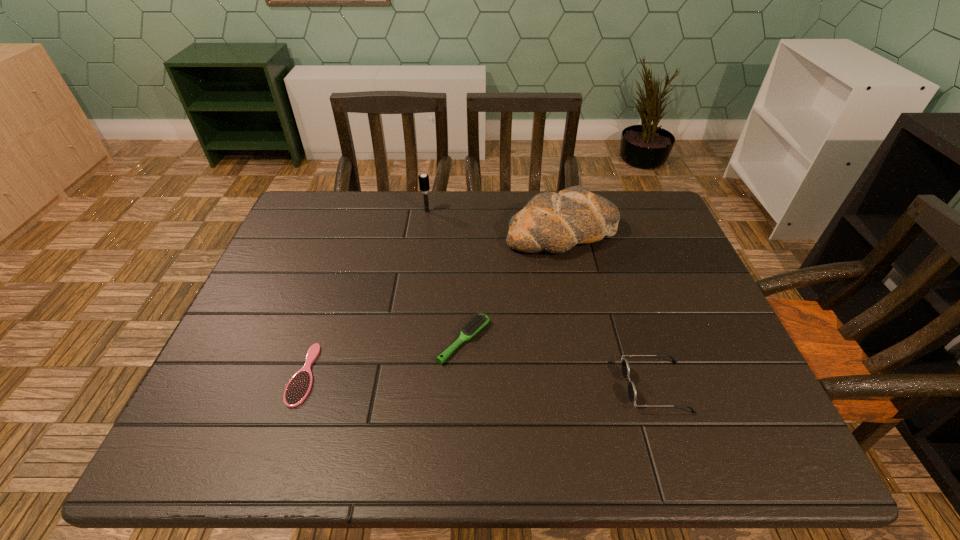
Where is `the second object from left to right`? the second object from left to right is located at coordinates (424, 183).

Identify the location of the second hairbrush from right to left. The image size is (960, 540). coord(424,183).

The height and width of the screenshot is (540, 960). In order to click on bread in this screenshot , I will do `click(555, 222)`.

Identify the location of the third shortest object. This screenshot has height=540, width=960. click(632, 393).

Where is `the third object from left to right`? the third object from left to right is located at coordinates (477, 322).

Image resolution: width=960 pixels, height=540 pixels. In order to click on the second tallest hairbrush in this screenshot , I will do 477,322.

This screenshot has height=540, width=960. Find the location of `the shortest object`. the shortest object is located at coordinates (298, 388).

Locate an element on the screen. the shortest hairbrush is located at coordinates (298, 388).

The width and height of the screenshot is (960, 540). Identify the location of free location located 0.390m on the front of the second hairbrush from right to left. (413, 310).

The width and height of the screenshot is (960, 540). I want to click on free space located on the front of the bread, so click(x=588, y=356).